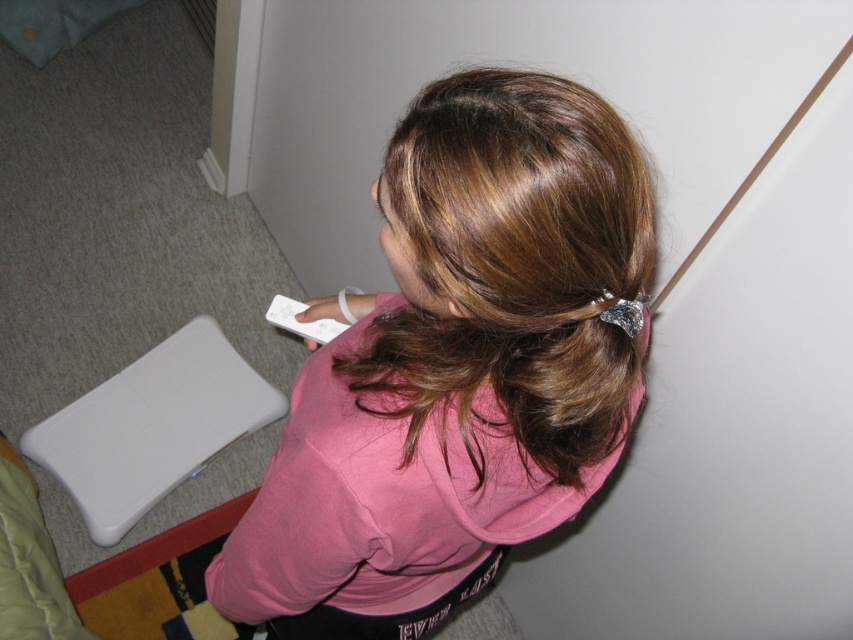
Question: Can you confirm if pink fabric shirt at center is smaller than white plastic remote at center?

Choices:
 (A) no
 (B) yes

Answer: (A)

Question: Can you confirm if pink fabric shirt at center is positioned above white plastic remote at center?

Choices:
 (A) yes
 (B) no

Answer: (B)

Question: Which object appears closest to the camera in this image?

Choices:
 (A) pink fabric shirt at center
 (B) white plastic remote at center

Answer: (A)

Question: Which point is farther to the camera?

Choices:
 (A) pink fabric shirt at center
 (B) white plastic remote at center

Answer: (B)

Question: Does pink fabric shirt at center appear on the left side of white plastic remote at center?

Choices:
 (A) no
 (B) yes

Answer: (A)

Question: Which of the following is the farthest from the observer?

Choices:
 (A) (312, 324)
 (B) (483, 563)

Answer: (A)